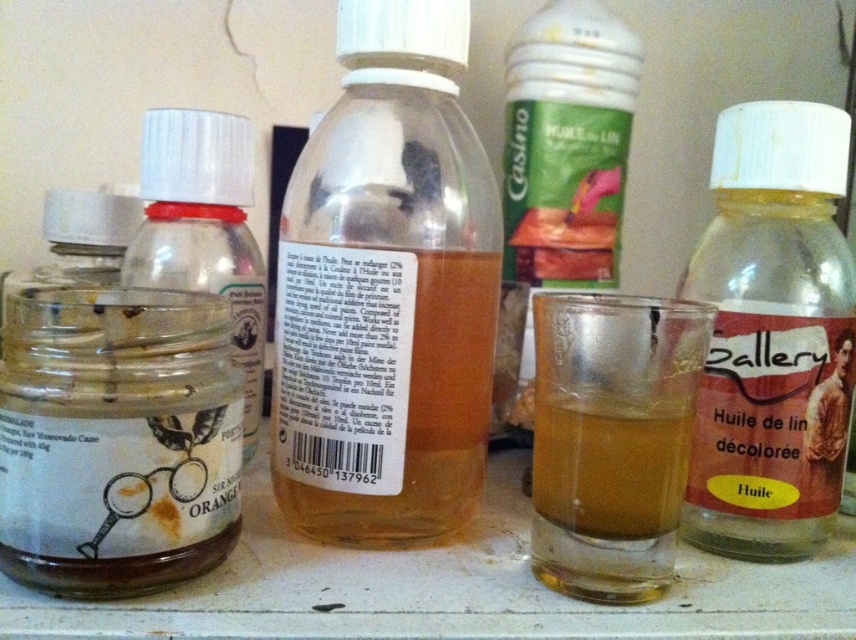
Between yellow translucent bottle at center and translucent glass bottle at left, which one has less height?

translucent glass bottle at left is shorter.

Is yellow translucent bottle at center above translucent glass bottle at left?

Actually, yellow translucent bottle at center is below translucent glass bottle at left.

Is point (809, 220) closer to viewer compared to point (254, 424)?

Yes, it is in front of point (254, 424).

At what (x,y) coordinates should I click in order to perform the action: click on yellow translucent bottle at center. Please return your answer as a coordinate pair (x, y). The width and height of the screenshot is (856, 640). Looking at the image, I should click on (771, 333).

Which is more to the right, translucent glass cup at center or translucent amber liquid at center?

Positioned to the right is translucent amber liquid at center.

Between point (603, 557) and point (673, 442), which one is positioned behind?

The point (603, 557) is more distant.

Where is `translucent glass cup at center`? Image resolution: width=856 pixels, height=640 pixels. translucent glass cup at center is located at coordinates (611, 440).

Is transparent glass jar at center-left to the right of translucent glass cup at center from the viewer's perspective?

Incorrect, transparent glass jar at center-left is not on the right side of translucent glass cup at center.

Can you confirm if transparent glass jar at center-left is smaller than translucent glass cup at center?

Actually, transparent glass jar at center-left might be larger than translucent glass cup at center.

Is point (100, 472) positioned before point (577, 592)?

Yes, it is.

You are a GUI agent. You are given a task and a screenshot of the screen. Output one action in this format:
    pyautogui.click(x=<x>, y=<y>)
    Task: Click on the transparent glass jar at center-left
    The image size is (856, 640).
    Given the screenshot: What is the action you would take?
    pyautogui.click(x=117, y=440)